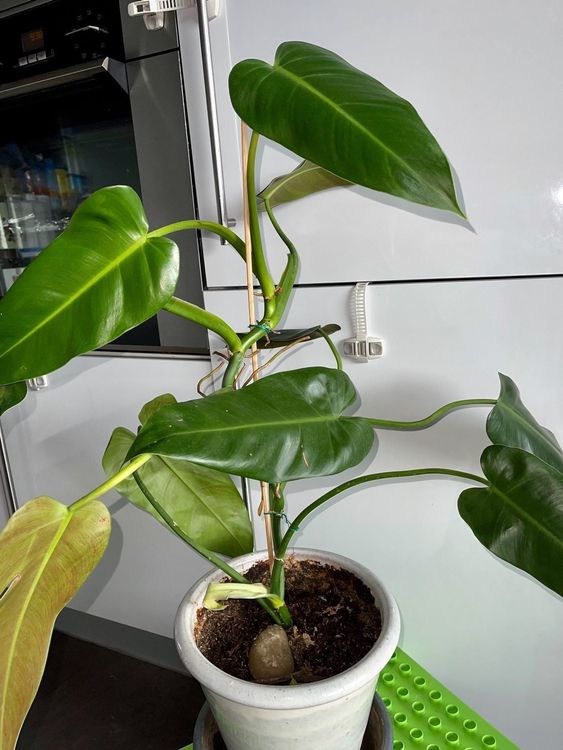
At what (x,y) coordinates should I click in order to perform the action: click on cabbinet. Please return your answer as a coordinate pair (x, y). The width and height of the screenshot is (563, 750). Looking at the image, I should click on (411, 272).